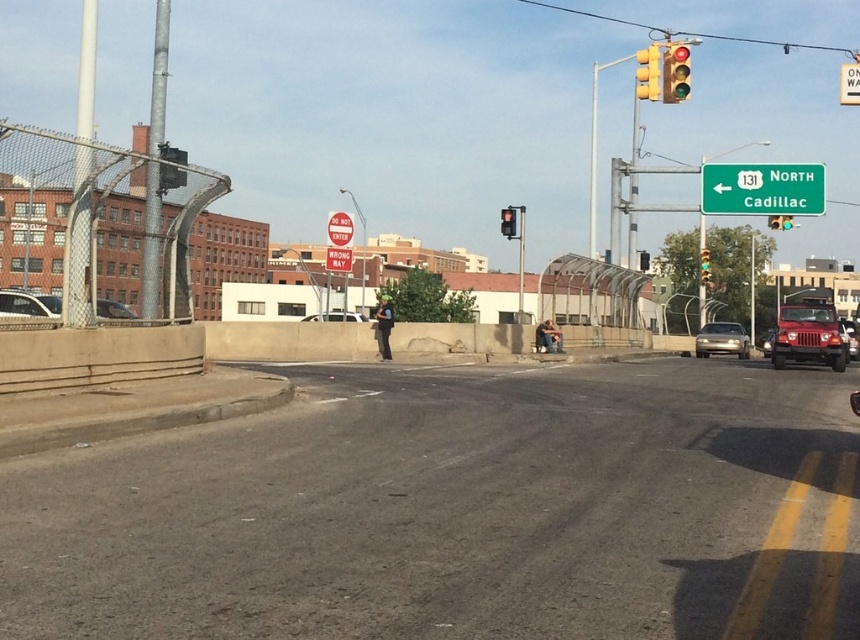
You are driving a car and see the metallic traffic light at upper left and the brushed metal sign at center. Which object is positioned more to the right side of the road?

The metallic traffic light at upper left is positioned more to the right side of the road compared to the brushed metal sign at center.

You are driving a car that is 15 feet long and want to pass another vehicle on the road. The asphalt at center and shiny silver sedan at center are in your path. Can your car fit between them and the double yellow line without crossing into the oncoming traffic lane?

The asphalt at center and shiny silver sedan at center are 18.43 feet apart. Since your car is 15 feet long, there is enough space to safely pass between them and the double yellow line without crossing into the oncoming traffic lane.